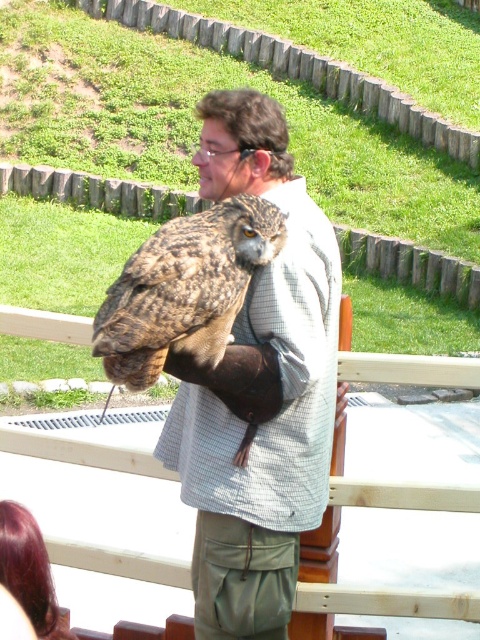
Question: Among these objects, which one is farthest from the camera?

Choices:
 (A) brown feathered owl at center
 (B) matte brown owl at upper center

Answer: (B)

Question: Does matte brown owl at upper center appear on the right side of brown feathered owl at center?

Choices:
 (A) no
 (B) yes

Answer: (B)

Question: Which point appears farthest from the camera in this image?

Choices:
 (A) (272, 524)
 (B) (222, 205)

Answer: (A)

Question: Is matte brown owl at upper center to the right of brown feathered owl at center from the viewer's perspective?

Choices:
 (A) no
 (B) yes

Answer: (B)

Question: Is matte brown owl at upper center positioned at the back of brown feathered owl at center?

Choices:
 (A) no
 (B) yes

Answer: (B)